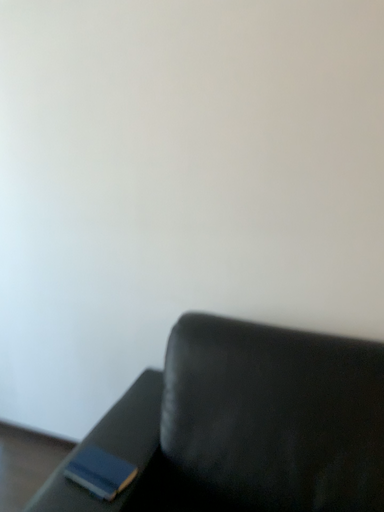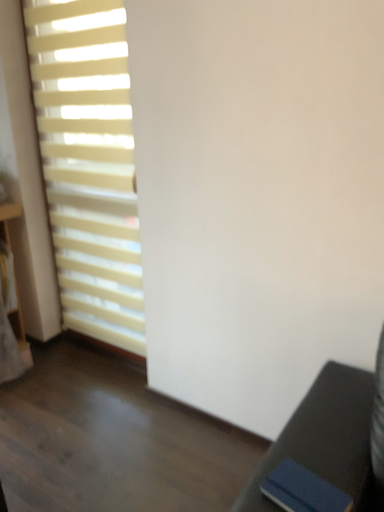
Question: Which way did the camera rotate in the video?

Choices:
 (A) rotated left
 (B) rotated right

Answer: (A)